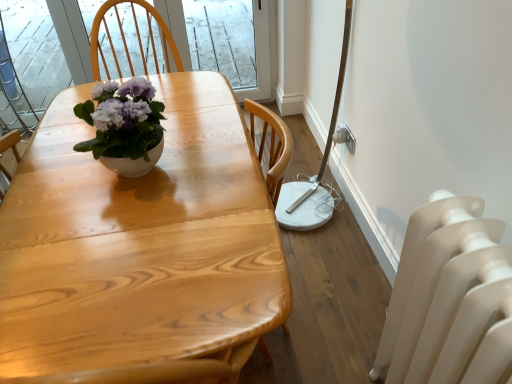
Measure the distance between point (434,207) and camera.

Point (434,207) is 1.00 meters from camera.

Describe the element at coordinates (124, 126) in the screenshot. The height and width of the screenshot is (384, 512). I see `white glossy pot at center` at that location.

Locate an element on the screen. white matte radiator at lower right is located at coordinates (445, 293).

Considering the sizes of objects natural wood table at center and white glossy pot at center in the image provided, who is bigger, natural wood table at center or white glossy pot at center?

With larger size is natural wood table at center.

Considering the positions of objects natural wood table at center and white glossy pot at center in the image provided, who is behind, natural wood table at center or white glossy pot at center?

white glossy pot at center.

From the image's perspective, is natural wood table at center above or below white glossy pot at center?

Based on their image positions, natural wood table at center is located beneath white glossy pot at center.

Are natural wood table at center and white glossy pot at center far apart?

natural wood table at center is actually quite close to white glossy pot at center.

What are the coordinates of `table in front of the white glossy pot at center` in the screenshot? It's located at (140, 250).

From a real-world perspective, which is physically below, white glossy pot at center or natural wood table at center?

natural wood table at center.

How much distance is there between white glossy pot at center and natural wood table at center?

white glossy pot at center and natural wood table at center are 26.49 centimeters apart from each other.

Is white glossy pot at center positioned with its back to natural wood table at center?

No.

Is white glossy pot at center spatially inside white matte radiator at lower right, or outside of it?

white glossy pot at center is not enclosed by white matte radiator at lower right.

Identify the location of radiator in front of the white glossy pot at center. (445, 293).

Considering the points (137, 80) and (452, 204), which point is behind, point (137, 80) or point (452, 204)?

The point (137, 80) is farther.

Can you confirm if white glossy pot at center is smaller than white matte radiator at lower right?

Yes, white glossy pot at center is smaller than white matte radiator at lower right.

Is natural wood table at center facing away from white matte radiator at lower right?

No.

Considering the relative positions of natural wood table at center and white matte radiator at lower right in the image provided, is natural wood table at center to the left or to the right of white matte radiator at lower right?

Clearly, natural wood table at center is on the left of white matte radiator at lower right in the image.

How far apart are natural wood table at center and white matte radiator at lower right?

natural wood table at center is 61.85 centimeters from white matte radiator at lower right.

How different are the orientations of natural wood table at center and white matte radiator at lower right in degrees?

There is a 91.3-degree angle between the facing directions of natural wood table at center and white matte radiator at lower right.

Would you say white matte radiator at lower right contains white glossy pot at center?

No.

Based on the photo, considering the relative positions of white matte radiator at lower right and white glossy pot at center in the image provided, is white matte radiator at lower right to the left of white glossy pot at center from the viewer's perspective?

In fact, white matte radiator at lower right is to the right of white glossy pot at center.

Which is less distant, (397, 366) or (160, 116)?

Point (397, 366) appears to be closer to the viewer than point (160, 116).

Image resolution: width=512 pixels, height=384 pixels. Identify the location of radiator that is on the right side of white glossy pot at center. (445, 293).

Image resolution: width=512 pixels, height=384 pixels. What are the coordinates of `radiator that is behind the natural wood table at center` in the screenshot? It's located at (445, 293).

From the image's perspective, is white matte radiator at lower right located above or below natural wood table at center?

white matte radiator at lower right is situated lower than natural wood table at center in the image.

Considering the positions of points (475, 280) and (7, 339), is point (475, 280) farther from camera compared to point (7, 339)?

No, (475, 280) is closer to viewer.

You are a GUI agent. You are given a task and a screenshot of the screen. Output one action in this format:
    pyautogui.click(x=<x>, y=<y>)
    Task: Click on the houseplant behind the natural wood table at center
    
    Given the screenshot: What is the action you would take?
    pyautogui.click(x=124, y=126)

Where is `houseplant that appears above the natural wood table at center (from the image's perspective)`? This screenshot has width=512, height=384. houseplant that appears above the natural wood table at center (from the image's perspective) is located at coordinates (124, 126).

When comparing their distances from white matte radiator at lower right, does white glossy pot at center or natural wood table at center seem closer?

Based on the image, natural wood table at center appears to be nearer to white matte radiator at lower right.

Which object lies nearer to the anchor point white glossy pot at center, natural wood table at center or white matte radiator at lower right?

Among the two, natural wood table at center is located nearer to white glossy pot at center.

From the image, which object appears to be farther from white matte radiator at lower right, natural wood table at center or white glossy pot at center?

white glossy pot at center lies further to white matte radiator at lower right than the other object.

Consider the image. Considering their positions, is white glossy pot at center positioned closer to natural wood table at center than white matte radiator at lower right?

white glossy pot at center lies closer to natural wood table at center than the other object.

Looking at the image, which one is located further to natural wood table at center, white matte radiator at lower right or white glossy pot at center?

white matte radiator at lower right is positioned further to the anchor natural wood table at center.

Considering their positions, is white matte radiator at lower right positioned further to white glossy pot at center than natural wood table at center?

Based on the image, white matte radiator at lower right appears to be further to white glossy pot at center.

This screenshot has width=512, height=384. I want to click on table between white glossy pot at center and white matte radiator at lower right from left to right, so tap(140, 250).